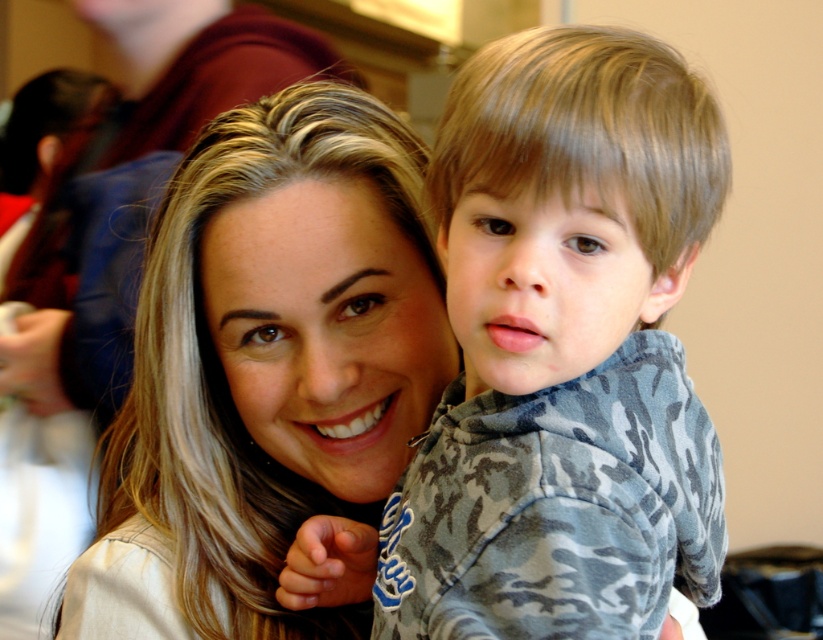
You are a photographer trying to capture a close shot of both the camouflage fleece at center and the smooth blonde hair at center. Since you want to focus on the wider object, which one should you choose?

The smooth blonde hair at center has a greater width than the camouflage fleece at center, so you should focus on the smooth blonde hair at center.

You are a photographer trying to capture a close portrait of both the camouflage fleece at center and the smooth blonde hair at center. Since you want to ensure both subjects are in focus, which one should you adjust your camera focus on first?

The camouflage fleece at center has a smaller size compared to smooth blonde hair at center, so you should focus on the camouflage fleece at center first to ensure both are in focus.